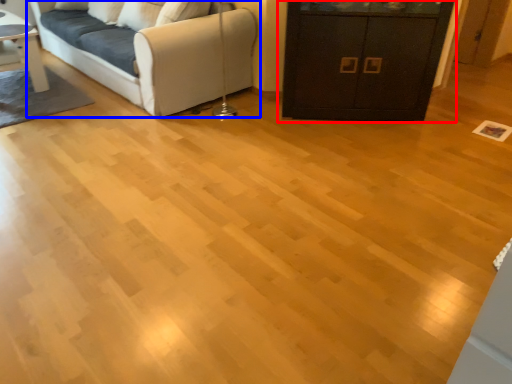
Question: Which of the following is the closest to the observer, cabinetry (highlighted by a red box) or studio couch (highlighted by a blue box)?

Choices:
 (A) cabinetry
 (B) studio couch

Answer: (A)